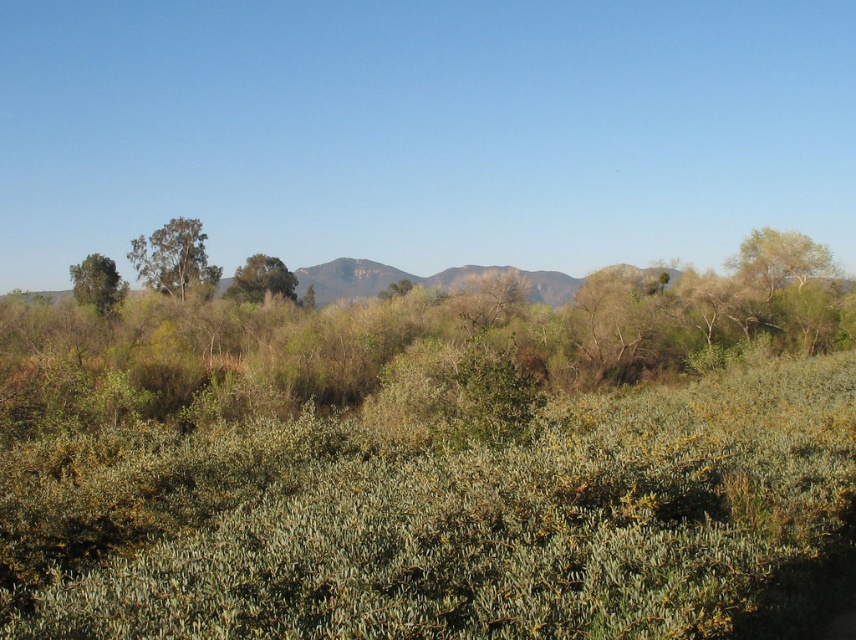
You are standing at the center of the landscape and want to locate the green leafy tree at upper left. Based on its coordinates, in which general direction should you look to find it?

The green leafy tree at upper left is located at coordinates approximately 0.405 on the x axis and 0.204 on the y axis. Since the x value is closer to the left side and the y value is closer to the top, you should look towards the upper left direction to find it.

You are standing in the landscape and want to take a photo of the green leafy tree at center. If your camera can focus on objects up to 60 meters away, will the tree be in focus?

The green leafy tree at center is 62.08 meters away from the viewer, which is beyond the camera focus limit of 60 meters. Therefore, the tree will not be in focus.

You are standing at the point marked by the coordinates point (174, 259) in the landscape. Which object is directly in front of you?

The point (174, 259) indicates the location of the green leafy tree at upper left, so the green leafy tree at upper left is directly in front of you.